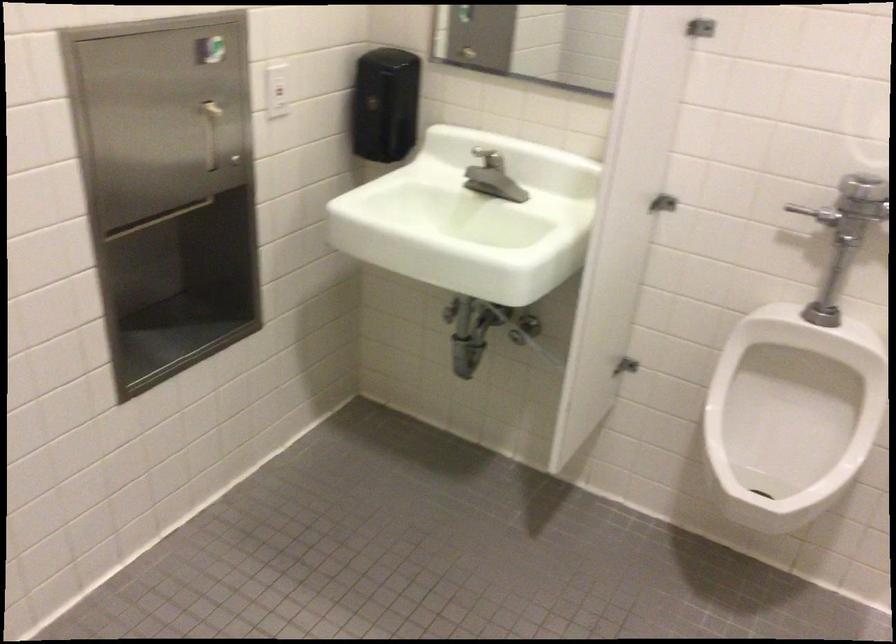
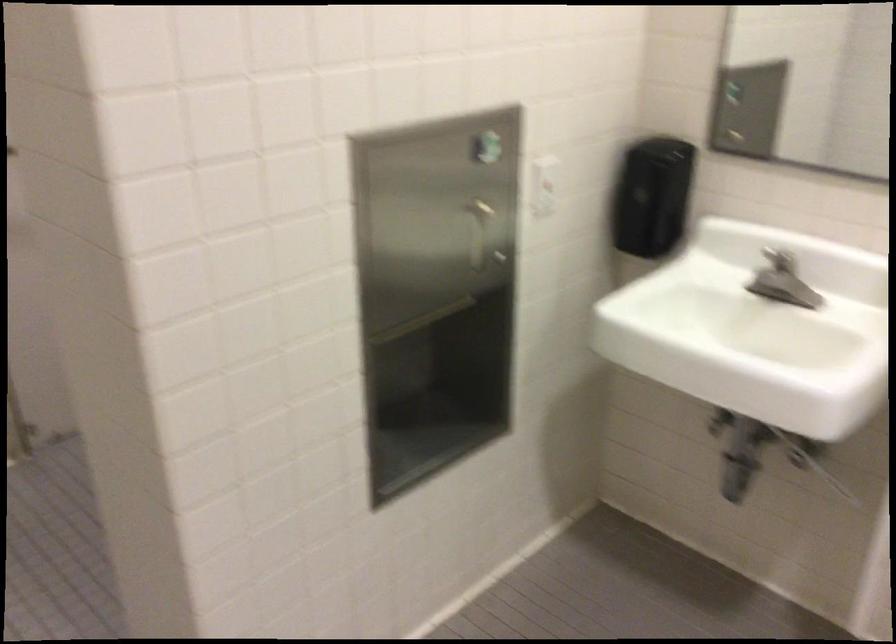
The point at (220, 77) is marked in the first image. Where is the corresponding point in the second image?

(493, 175)